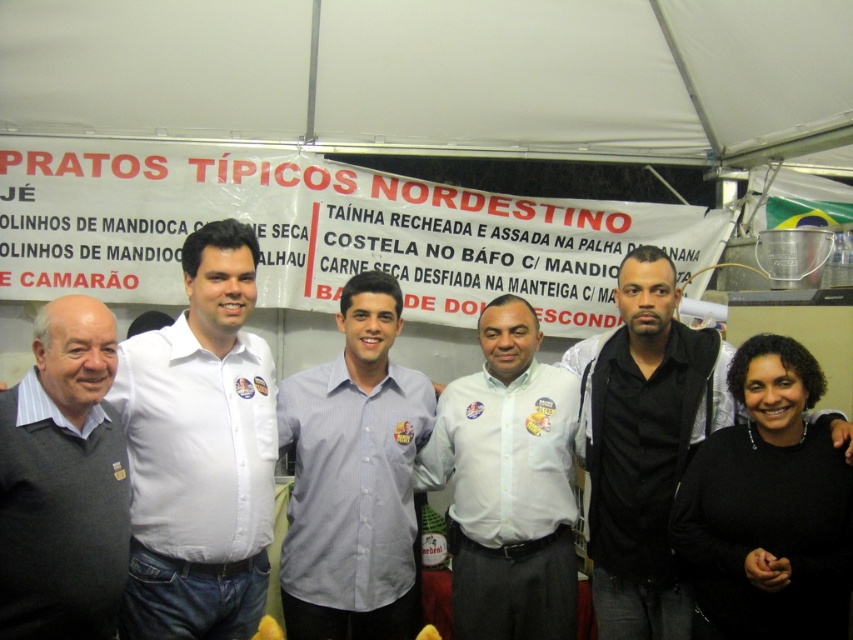
Is white matte shirt at center to the right of black matte shirt at right from the viewer's perspective?

No, white matte shirt at center is not to the right of black matte shirt at right.

At what (x,y) coordinates should I click in order to perform the action: click on white matte shirt at center. Please return your answer as a coordinate pair (x, y). This screenshot has width=853, height=640. Looking at the image, I should click on (200, 451).

Which is behind, point (161, 616) or point (593, 602)?

The point (593, 602) is more distant.

Locate an element on the screen. The image size is (853, 640). white matte shirt at center is located at coordinates (200, 451).

Is white fabric canopy at upper center positioned in front of gray sweater at left?

That is False.

Is white fabric canopy at upper center above gray sweater at left?

Correct, white fabric canopy at upper center is located above gray sweater at left.

This screenshot has height=640, width=853. Describe the element at coordinates (430, 70) in the screenshot. I see `white fabric canopy at upper center` at that location.

Locate an element on the screen. white fabric canopy at upper center is located at coordinates (430, 70).

Is the position of black matte shirt at right more distant than that of gray sweater at left?

Yes, black matte shirt at right is further from the viewer.

What do you see at coordinates (643, 444) in the screenshot? The width and height of the screenshot is (853, 640). I see `black matte shirt at right` at bounding box center [643, 444].

Between point (689, 410) and point (12, 554), which one is positioned behind?

The point (689, 410) is more distant.

Locate an element on the screen. The width and height of the screenshot is (853, 640). black matte shirt at right is located at coordinates (643, 444).